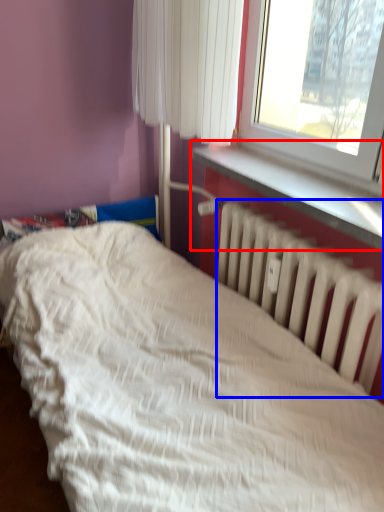
Question: Which of the following is the farthest to the observer, window sill (highlighted by a red box) or radiator (highlighted by a blue box)?

Choices:
 (A) window sill
 (B) radiator

Answer: (B)